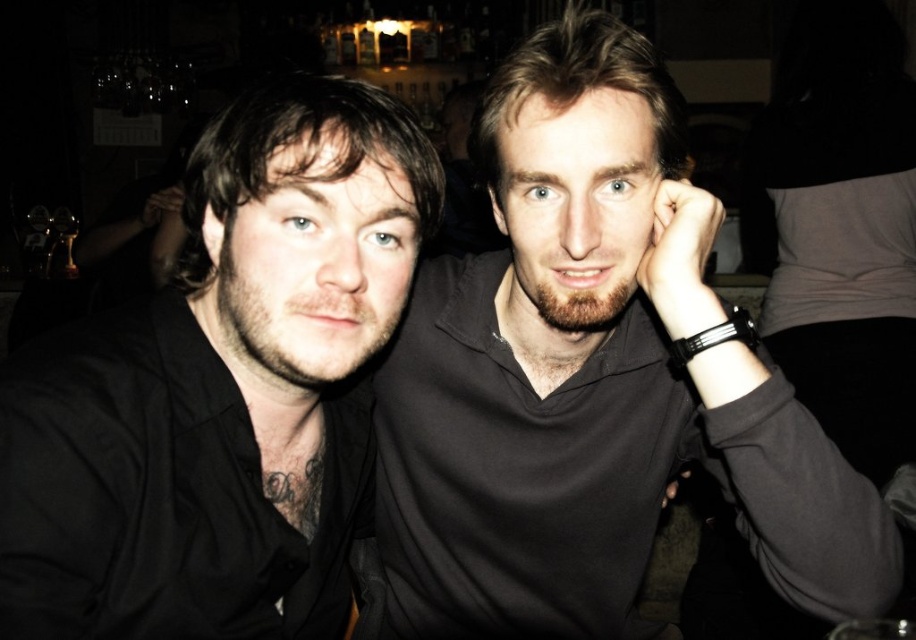
You are a photographer adjusting your camera settings to capture a clear image of the two people in the scene. The focus point is set at point (525, 109). Given that the optimal focus distance for your camera lens is 30 inches, will the focus point be within the optimal range?

The distance of point (525, 109) from the camera is 29.64 inches, which is just below the optimal focus distance of 30 inches. Therefore, the focus point is within the optimal range.

From the picture: You are at a bar and want to order a drink. You notice two people wearing matte black shirts in the image. Which person is closer to the bar counter, the one wearing the matte black shirt at center or the matte black shirt at left?

The matte black shirt at center is below the matte black shirt at left, indicating that the person wearing the matte black shirt at center is closer to the bar counter.

You are a photographer adjusting your camera settings to focus on two points in the image. The first point is at coordinates point (642, 291) and the second is at point (297, 636). Which point should you focus on first if you want to ensure the closest object is in sharp focus?

Point (642, 291) is closer to the camera than point (297, 636), so you should focus on point (642, 291) first to ensure the closest object is in sharp focus.